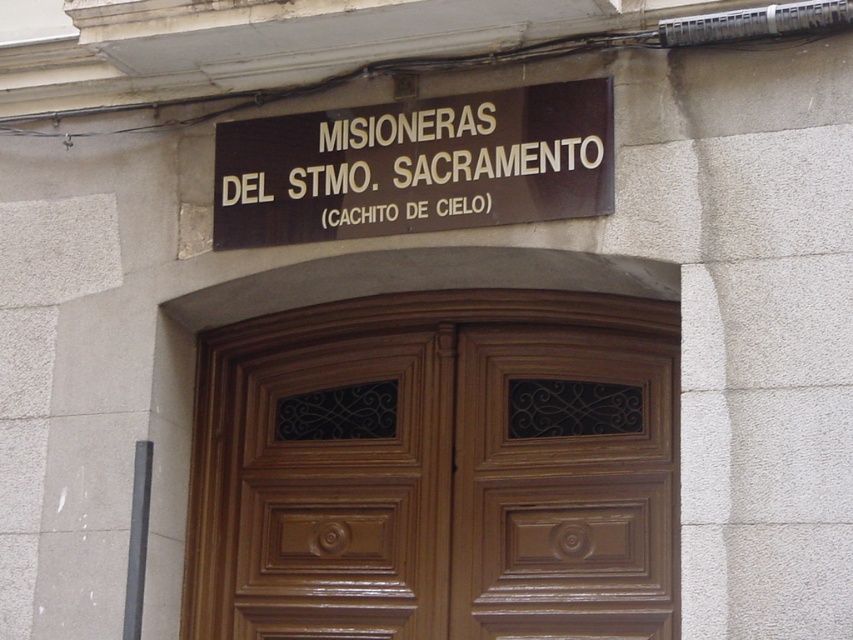
You are a painter who needs to cover all surfaces of the glossy wood door at center and the brown polished wood sign at upper center. If the sign requires 0.5 liters of paint per square meter, how much paint do you need in total?

The glossy wood door at center is larger in size than brown polished wood sign at upper center. However, without specific dimensions for both objects, it is impossible to calculate the exact amount of paint required. Please provide more details about their sizes.

You are standing in front of the building shown in the image. You want to locate the glossy wood door at center. Can you tell me its coordinates?

The glossy wood door at center is located at coordinates point (436, 468).

You are standing in front of the building and want to determine which of the two points, point (579,522) or point (521,209), is closer to you. Based on the facade details, which point is nearer?

Point (579,522) is closer to you because it is further to the viewer than point (521,209) according to the spatial description.